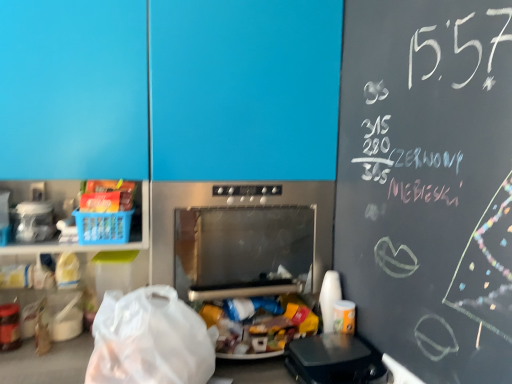
Question: From a real-world perspective, relative to clear plastic container at left, placed as the first appliance when sorted from top to bottom, is stainless steel microwave at center, arranged as the 2th appliance when viewed from the right, vertically above or below?

Choices:
 (A) below
 (B) above

Answer: (A)

Question: Considering the positions of stainless steel microwave at center, which appears as the 2th appliance when viewed from the left, and clear plastic container at left, the 3th appliance when ordered from bottom to top, in the image, is stainless steel microwave at center, which appears as the 2th appliance when viewed from the left, wider or thinner than clear plastic container at left, the 3th appliance when ordered from bottom to top,?

Choices:
 (A) thin
 (B) wide

Answer: (B)

Question: Estimate the real-world distances between objects in this image. Which object is closer to the black plastic waffle maker at lower right, the first appliance in the right-to-left sequence?

Choices:
 (A) stainless steel microwave at center, which appears as the 2th appliance when viewed from the left
 (B) metallic oven at center
 (C) clear plastic container at left, placed as the first appliance when sorted from top to bottom
 (D) transparent plastic grocery bag at lower left

Answer: (A)

Question: Based on their relative distances, which object is nearer to the metallic oven at center?

Choices:
 (A) clear plastic container at left, placed as the first appliance when sorted from top to bottom
 (B) transparent plastic grocery bag at lower left
 (C) stainless steel microwave at center, which appears as the 2th appliance when viewed from the left
 (D) black plastic waffle maker at lower right, arranged as the 3th appliance when viewed from the top

Answer: (C)